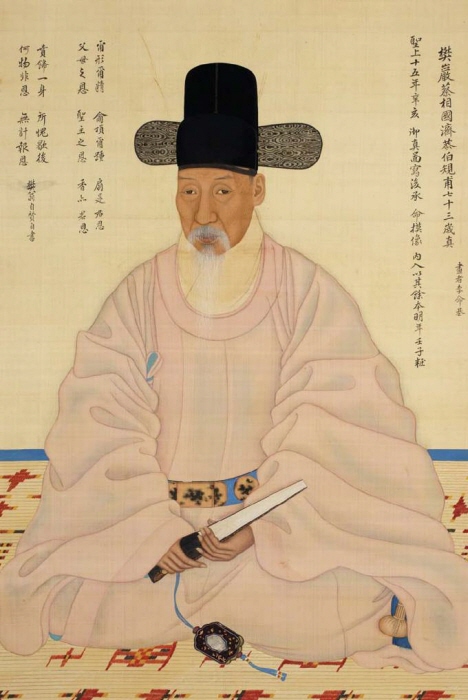
Identify the location of book. (247, 511).